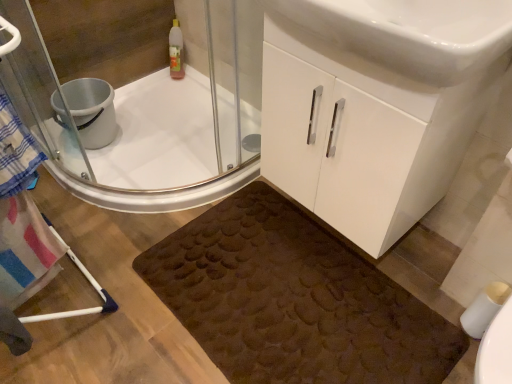
Find the location of a particular element. This screenshot has height=384, width=512. empty space that is in between silver metallic bucket at upper left and clear glass shower door at upper left is located at coordinates pos(160,154).